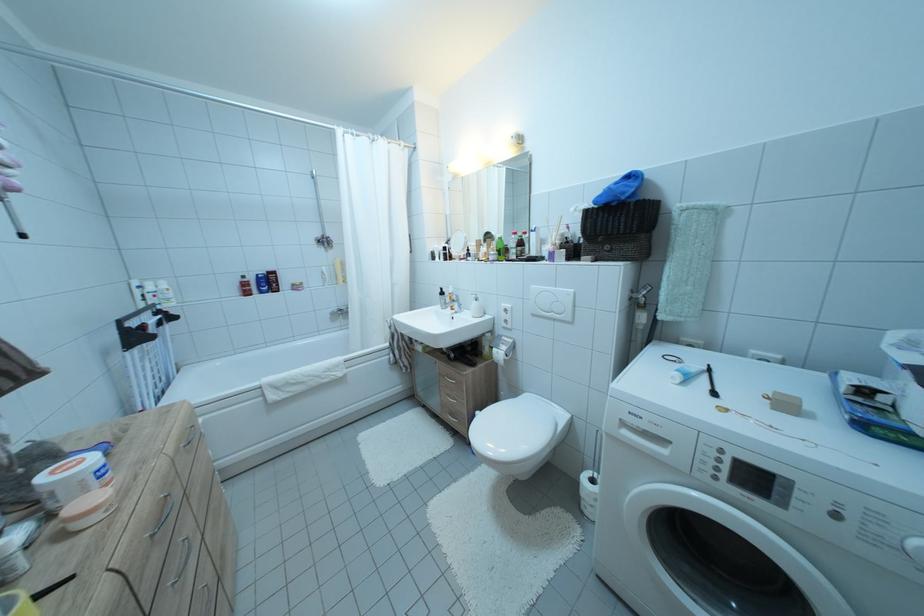
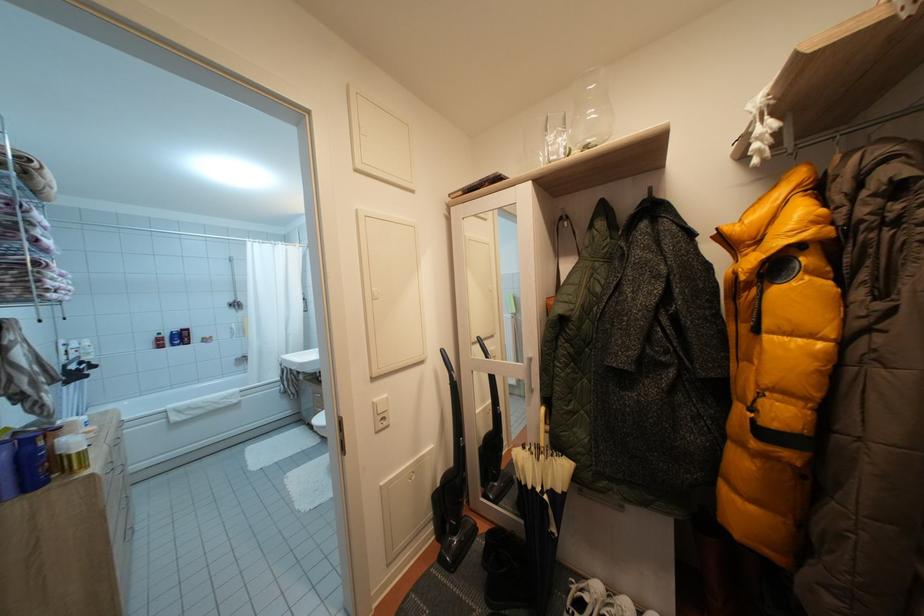
The images are taken continuously from a first-person perspective. In which direction are you moving?

The cameraman moved toward right, backward.